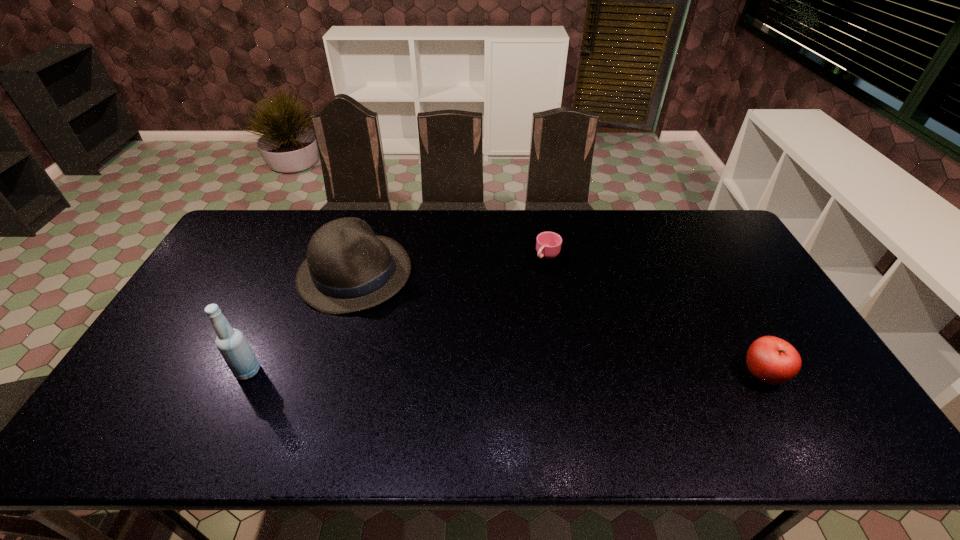
Where is `vacant region located on the front-facing side of the third shortest object`? vacant region located on the front-facing side of the third shortest object is located at coordinates (421, 315).

Find the location of a particular element. The width and height of the screenshot is (960, 540). vacant space located on the side with the handle of the cup is located at coordinates (516, 353).

At what (x,y) coordinates should I click in order to perform the action: click on free space located on the side with the handle of the cup. Please return your answer as a coordinate pair (x, y). The height and width of the screenshot is (540, 960). Looking at the image, I should click on (535, 293).

The image size is (960, 540). Identify the location of vacant region located on the side with the handle of the cup. (539, 282).

You are a GUI agent. You are given a task and a screenshot of the screen. Output one action in this format:
    pyautogui.click(x=<x>, y=<y>)
    Task: Click on the bowler hat located in the far edge section of the desktop
    The image size is (960, 540).
    Given the screenshot: What is the action you would take?
    pyautogui.click(x=348, y=268)

At what (x,y) coordinates should I click in order to perform the action: click on cup situated at the far edge. Please return your answer as a coordinate pair (x, y). Looking at the image, I should click on (548, 250).

I want to click on bottle at the near edge, so click(234, 348).

At what (x,y) coordinates should I click in order to perform the action: click on apple present at the near edge. Please return your answer as a coordinate pair (x, y). This screenshot has width=960, height=540. Looking at the image, I should click on (772, 360).

This screenshot has height=540, width=960. I want to click on object that is positioned at the right edge, so click(x=772, y=360).

Image resolution: width=960 pixels, height=540 pixels. In order to click on object at the near right corner in this screenshot , I will do `click(772, 360)`.